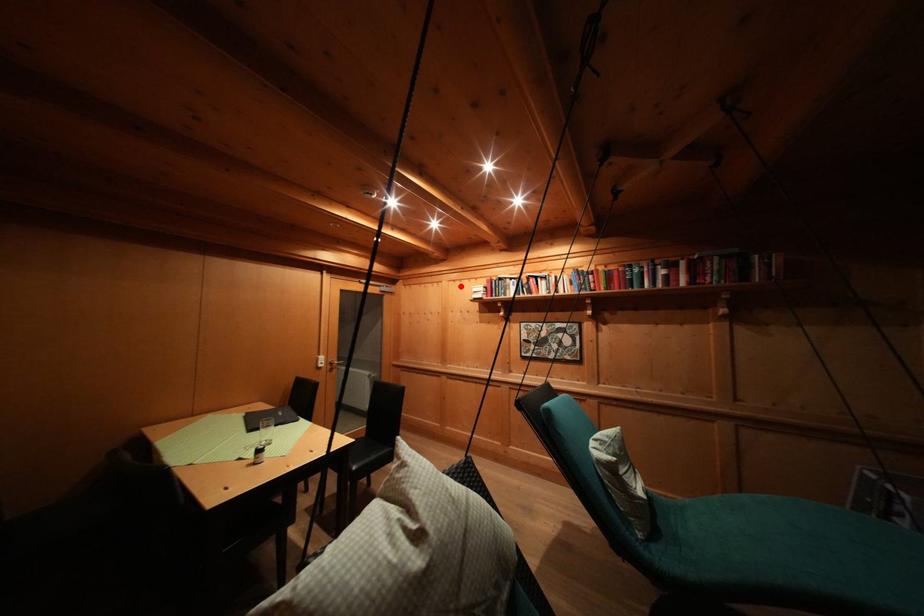
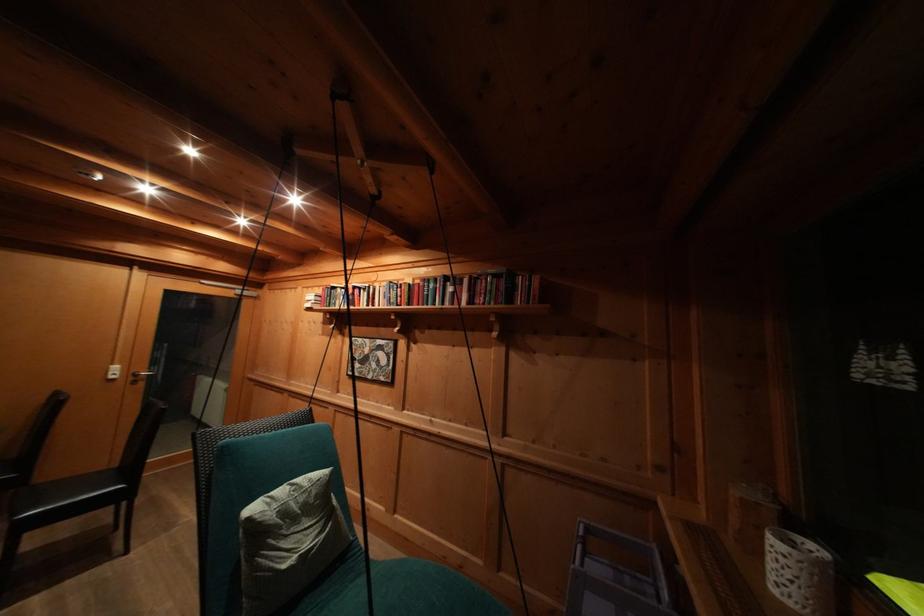
Where in the second image is the point corresponding to the highlighted location from the first image?

(313, 293)